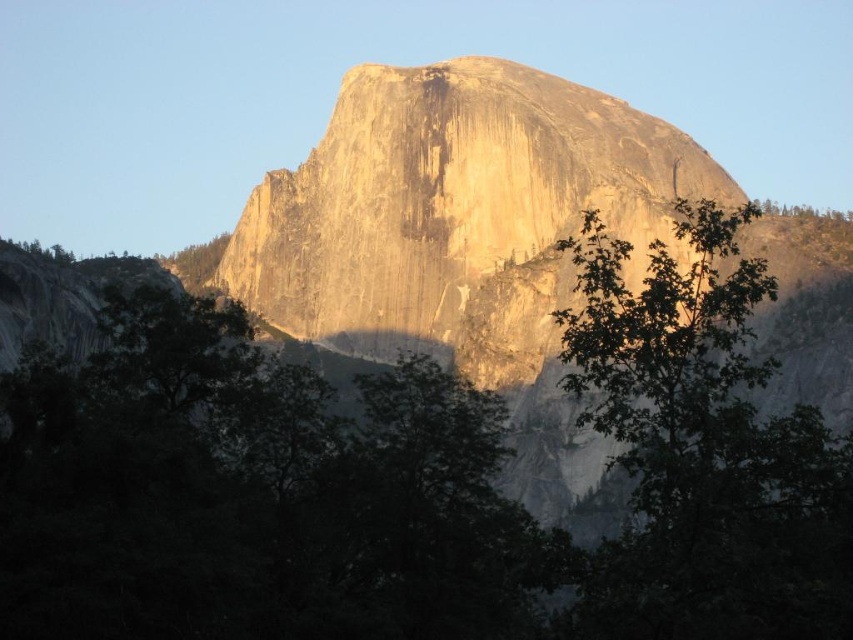
Does green leafy tree at center have a lesser height compared to yellowish rock at center?

Yes, green leafy tree at center is shorter than yellowish rock at center.

At what (x,y) coordinates should I click in order to perform the action: click on green leafy tree at center. Please return your answer as a coordinate pair (x, y). Looking at the image, I should click on (419, 481).

This screenshot has height=640, width=853. What do you see at coordinates (419, 481) in the screenshot? I see `green leafy tree at center` at bounding box center [419, 481].

Locate an element on the screen. The width and height of the screenshot is (853, 640). green leafy tree at center is located at coordinates (419, 481).

Is point (717, 196) closer to camera compared to point (700, 324)?

No.

Between point (231, 291) and point (698, 253), which one is positioned in front?

Point (698, 253)

Is point (624, 150) more distant than point (816, 422)?

Yes, point (624, 150) is farther from viewer.

In order to click on yellowish rock at center in this screenshot , I will do (x=456, y=212).

Is the position of green leafy tree at center more distant than that of green leafy tree at right?

Yes.

Consider the image. Who is positioned more to the right, green leafy tree at center or green leafy tree at right?

green leafy tree at right

Identify the location of green leafy tree at center. (419, 481).